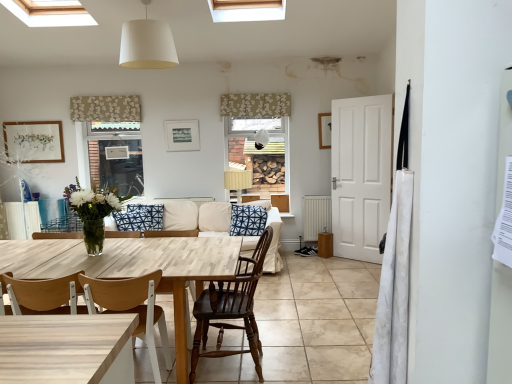
Question: Relative to white fabric lampshade at upper center, arranged as the first lamp when viewed from the right, is woven fabric lampshade at center, the second lamp when ordered from front to back, in front or behind?

Choices:
 (A) front
 (B) behind

Answer: (A)

Question: In terms of height, does woven fabric lampshade at center, positioned as the third lamp in top-to-bottom order, look taller or shorter compared to white fabric lampshade at upper center, which appears as the third lamp when viewed from the left?

Choices:
 (A) short
 (B) tall

Answer: (B)

Question: Estimate the real-world distances between objects in this image. Which object is farther from the light wood table at center?

Choices:
 (A) white fabric lampshade at upper center, which is the third lamp in bottom-to-top order
 (B) floral fabric valance at upper center, the 2th curtain from the left
 (C) mahogany wood chair at center, which appears as the second chair when viewed from the left
 (D) beige floral fabric at upper left, which is the third curtain from front to back
 (E) matte gold picture frame at upper left, which is the first picture frame from left to right

Answer: (B)

Question: Estimate the real-world distances between objects in this image. Which object is closer to the floral fabric valance at upper center, arranged as the 2th curtain when viewed from the front?

Choices:
 (A) light wood/wooden chair at center, marked as the first chair in a left-to-right arrangement
 (B) white fabric curtain at right, acting as the first curtain starting from the bottom
 (C) beige floral fabric at upper left, which ranks as the 1th curtain in left-to-right order
 (D) white fabric lampshade at upper center, which appears as the third lamp when viewed from the back
 (E) blue printed cushion at center

Answer: (C)